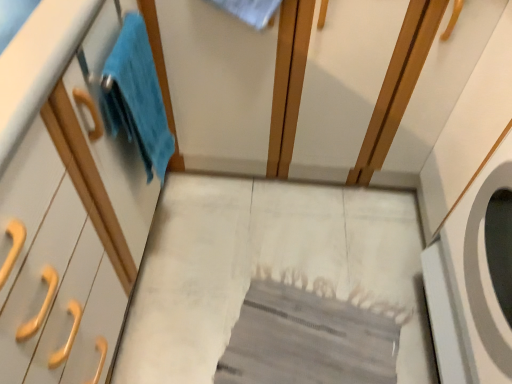
Question: Is blue fluffy towel at left to the right of white matte cabinet at left from the viewer's perspective?

Choices:
 (A) yes
 (B) no

Answer: (A)

Question: Considering the relative sizes of blue fluffy towel at left and white matte cabinet at left in the image provided, is blue fluffy towel at left thinner than white matte cabinet at left?

Choices:
 (A) no
 (B) yes

Answer: (B)

Question: Is blue fluffy towel at left closer to the viewer compared to white matte cabinet at left?

Choices:
 (A) no
 (B) yes

Answer: (A)

Question: Would you consider blue fluffy towel at left to be distant from white matte cabinet at left?

Choices:
 (A) yes
 (B) no

Answer: (B)

Question: Considering the relative sizes of blue fluffy towel at left and white matte cabinet at left in the image provided, is blue fluffy towel at left bigger than white matte cabinet at left?

Choices:
 (A) no
 (B) yes

Answer: (A)

Question: From the image's perspective, is blue fluffy towel at left beneath white matte cabinet at left?

Choices:
 (A) no
 (B) yes

Answer: (A)

Question: Is blue fluffy towel at left surrounded by white matte cabinet at left?

Choices:
 (A) no
 (B) yes

Answer: (B)

Question: Considering the relative sizes of white matte cabinet at left and blue fluffy towel at left in the image provided, is white matte cabinet at left shorter than blue fluffy towel at left?

Choices:
 (A) yes
 (B) no

Answer: (B)

Question: From the image's perspective, is white matte cabinet at left below blue fluffy towel at left?

Choices:
 (A) yes
 (B) no

Answer: (A)

Question: From a real-world perspective, is white matte cabinet at left on blue fluffy towel at left?

Choices:
 (A) no
 (B) yes

Answer: (A)

Question: Does white matte cabinet at left have a greater width compared to blue fluffy towel at left?

Choices:
 (A) no
 (B) yes

Answer: (B)

Question: Is white matte cabinet at left further to camera compared to blue fluffy towel at left?

Choices:
 (A) yes
 (B) no

Answer: (B)

Question: Is blue fluffy towel at left wider or thinner than white matte cabinet at left?

Choices:
 (A) wide
 (B) thin

Answer: (B)